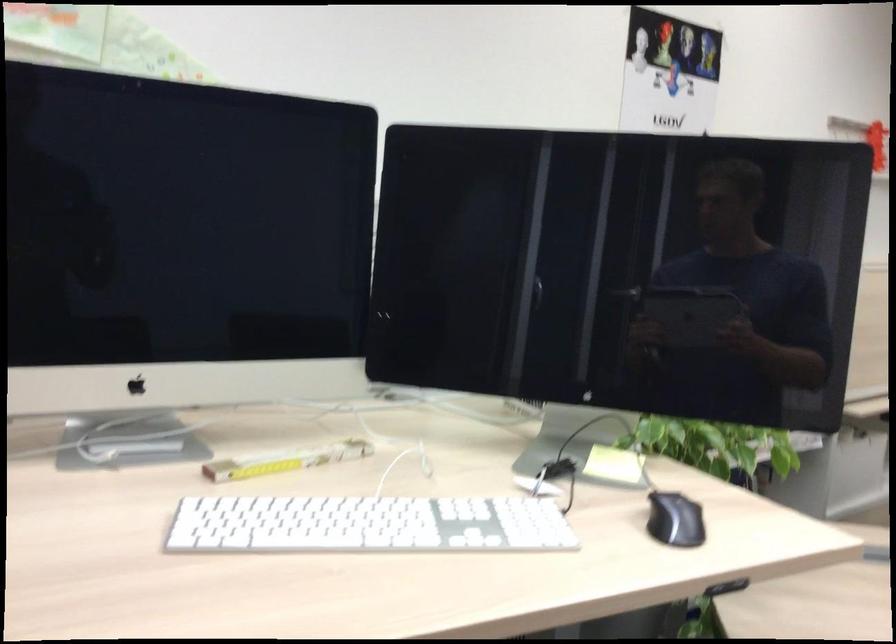
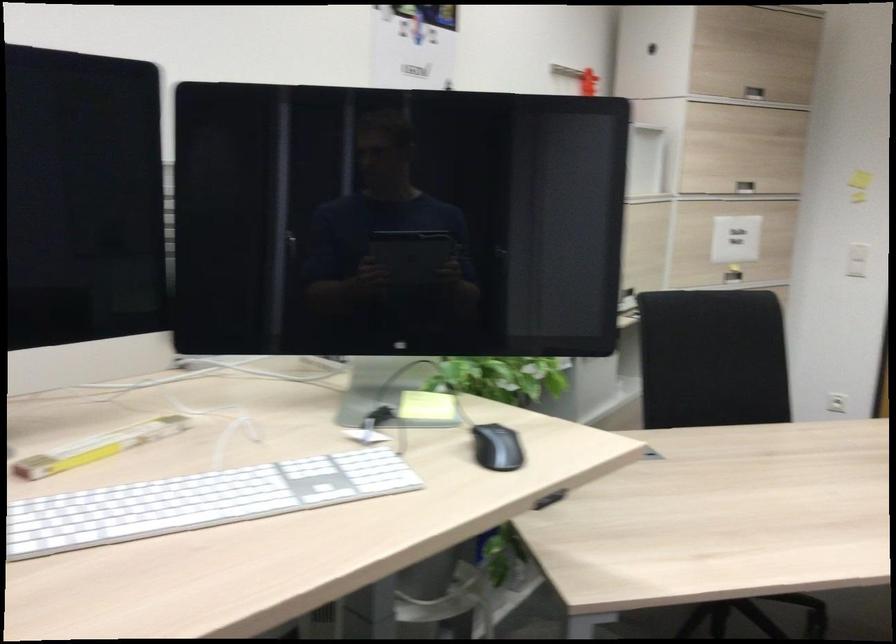
Question: The first image is from the beginning of the video and the second image is from the end. How did the camera likely rotate when shooting the video?

Choices:
 (A) Left
 (B) Right
 (C) Up
 (D) Down

Answer: (B)